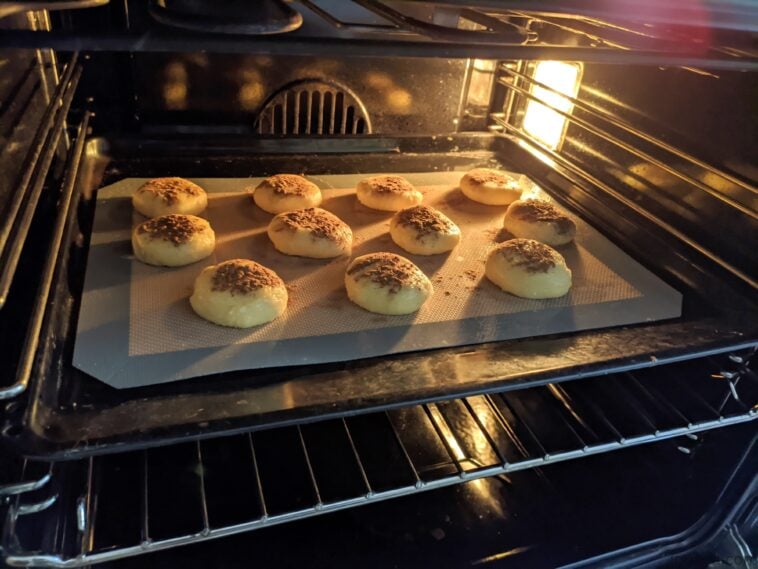
Locate an element on the screen. The height and width of the screenshot is (569, 758). slots in vent at rear of oven is located at coordinates (265, 122), (277, 121), (290, 108), (302, 106), (314, 102), (327, 112), (339, 113), (349, 119), (359, 126).